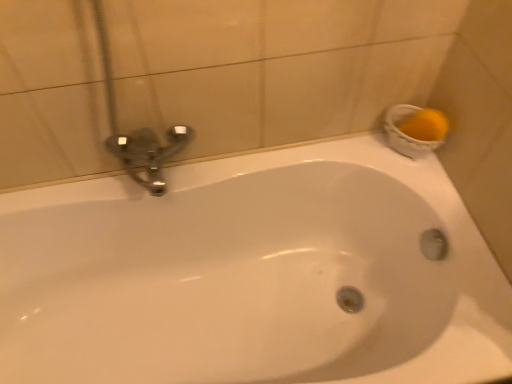
What are the coordinates of `white glossy bathtub at center` in the screenshot? It's located at (258, 272).

This screenshot has width=512, height=384. Describe the element at coordinates (258, 272) in the screenshot. I see `white glossy bathtub at center` at that location.

Find the location of a particular element. This screenshot has width=512, height=384. white glossy bathtub at center is located at coordinates (258, 272).